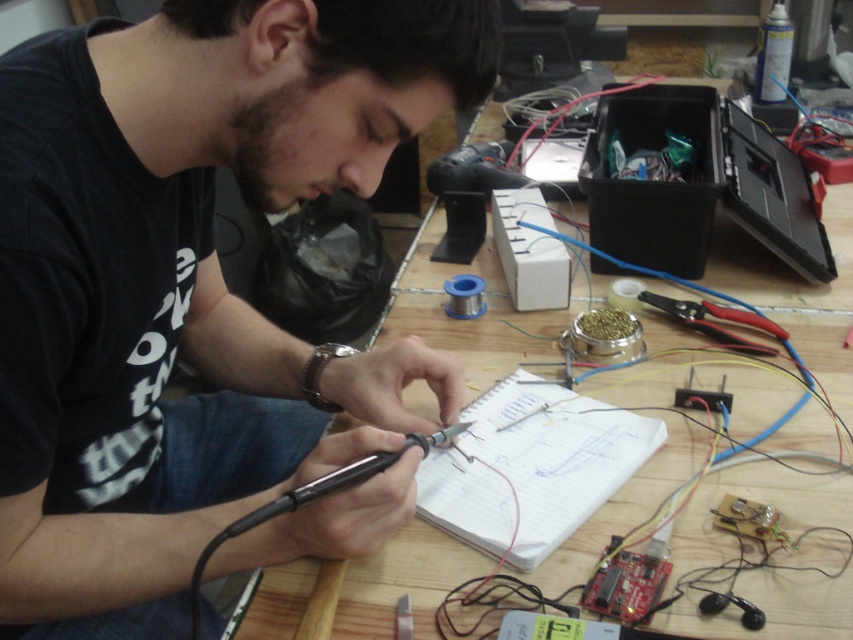
Question: Can you confirm if black matte soldering iron at center is smaller than white paper at center?

Choices:
 (A) yes
 (B) no

Answer: (B)

Question: Which point appears closest to the camera in this image?

Choices:
 (A) (473, 406)
 (B) (405, 273)
 (C) (93, 292)
 (D) (705, 308)

Answer: (C)

Question: Based on their relative distances, which object is nearer to the black matte soldering iron at center?

Choices:
 (A) white paper at center
 (B) red plastic pliers at center right
 (C) wooden table at center

Answer: (A)

Question: Which of the following is the farthest from the observer?

Choices:
 (A) red plastic pliers at center right
 (B) white paper at center
 (C) black matte soldering iron at center
 (D) wooden table at center

Answer: (A)

Question: Is the position of black matte soldering iron at center more distant than that of wooden table at center?

Choices:
 (A) yes
 (B) no

Answer: (B)

Question: Is black matte soldering iron at center to the left of white paper at center from the viewer's perspective?

Choices:
 (A) yes
 (B) no

Answer: (A)